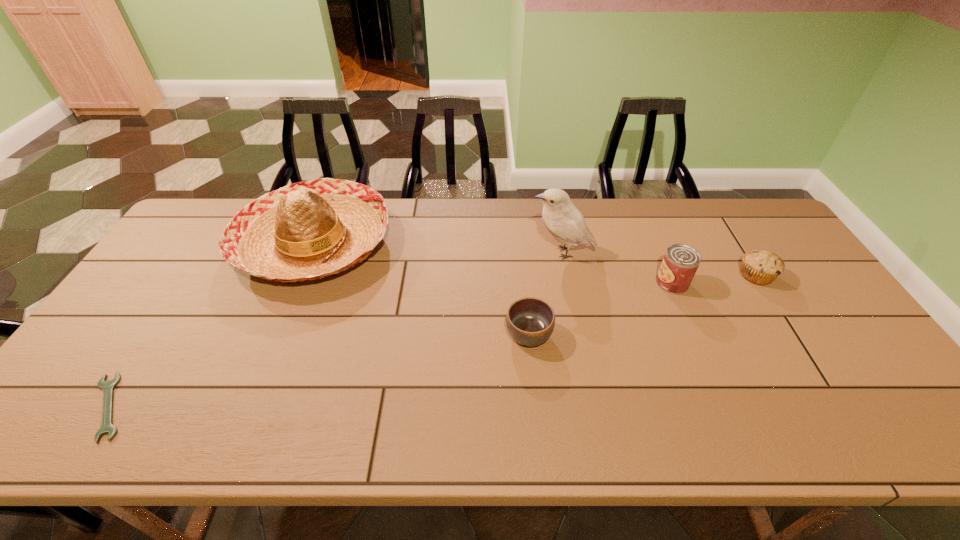
Find the location of a particular element. Image resolution: width=960 pixels, height=540 pixels. free spot located 0.060m at the beak of the tallest object is located at coordinates click(510, 253).

At what (x,y) coordinates should I click in order to perform the action: click on vacant position located 0.200m at the beak of the tallest object. Please return your answer as a coordinate pair (x, y). The width and height of the screenshot is (960, 540). Looking at the image, I should click on click(x=465, y=253).

Where is `vacant space located on the front of the fifth shortest object`? This screenshot has height=540, width=960. vacant space located on the front of the fifth shortest object is located at coordinates (283, 321).

Find the location of a particular element. The image size is (960, 540). free space located 0.120m on the left of the second object from right to left is located at coordinates (615, 284).

Find the location of a particular element. free point located on the front of the muffin is located at coordinates (814, 369).

This screenshot has width=960, height=540. Identify the location of vacant area situated on the right of the bowl. (594, 335).

Image resolution: width=960 pixels, height=540 pixels. In order to click on vacant space located 0.050m on the left of the nearest object in this screenshot , I will do `click(62, 407)`.

You are a GUI agent. You are given a task and a screenshot of the screen. Output one action in this format:
    pyautogui.click(x=<x>, y=<y>)
    Task: Click on the object that is at the far edge
    Image resolution: width=960 pixels, height=540 pixels.
    Given the screenshot: What is the action you would take?
    pyautogui.click(x=309, y=230)

Locate an element on the screen. The height and width of the screenshot is (540, 960). object located in the near edge section of the desktop is located at coordinates (107, 427).

This screenshot has width=960, height=540. I want to click on object that is at the left edge, so click(x=107, y=427).